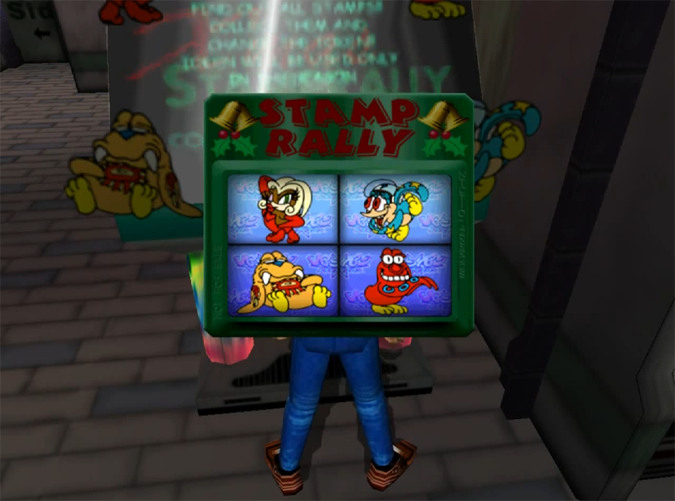
Find the location of a particular element. brick floor is located at coordinates (78, 331).